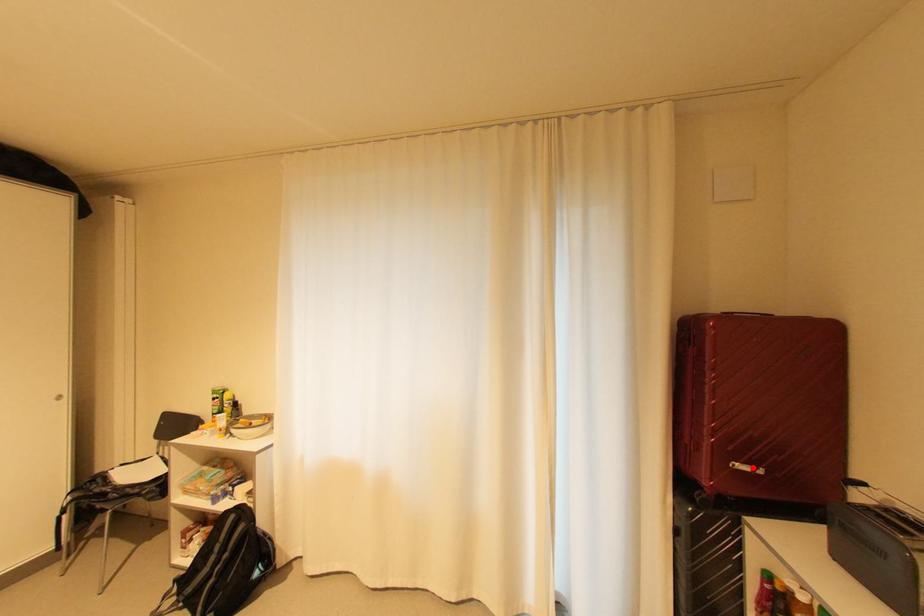
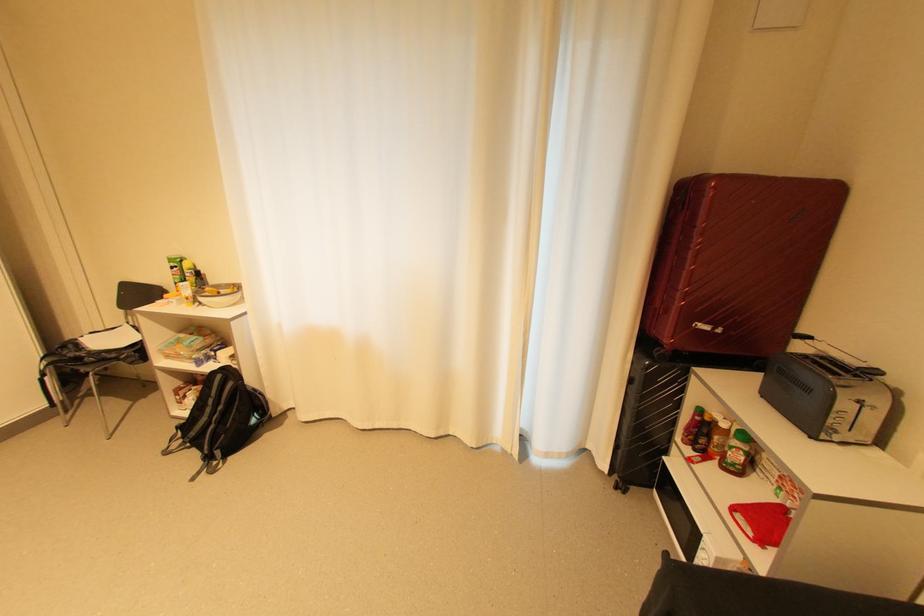
The point at the highlighted location is marked in the first image. Where is the corresponding point in the second image?

(713, 328)